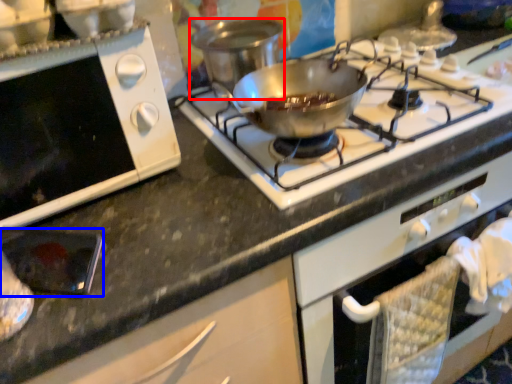
Question: Which object is closer to the camera taking this photo, pot/pan (highlighted by a red box) or appliance (highlighted by a blue box)?

Choices:
 (A) pot/pan
 (B) appliance

Answer: (B)